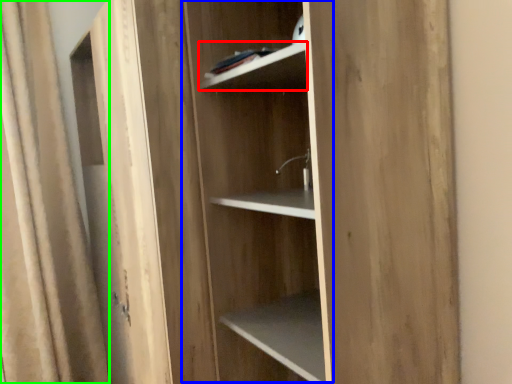
Question: Which object is positioned farthest from cabinet (highlighted by a red box)? Select from cabinetry (highlighted by a blue box) and curtain (highlighted by a green box).

Choices:
 (A) cabinetry
 (B) curtain

Answer: (B)